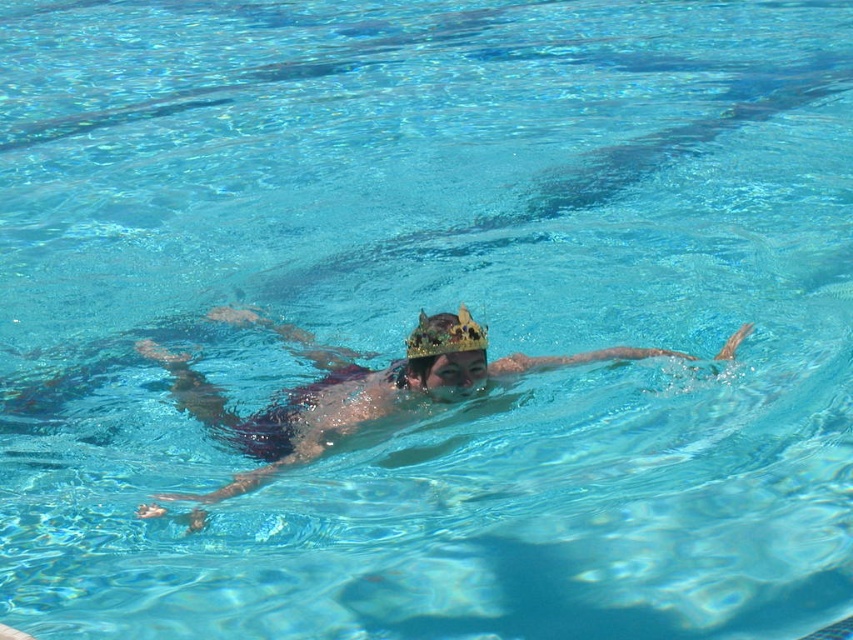
You are designing a poster for a pool party and want to highlight the swimmer with the crown. Which crown is larger in size between the metallic gold crown at center and the gold glittery crown at center?

The metallic gold crown at center is bigger than the gold glittery crown at center, so the metallic gold crown at center should be emphasized in the poster design.

You are a photographer trying to capture the swimmer with both the metallic gold crown at center and the gold glittery crown at center. Which crown will appear closer to the camera in the photo?

The metallic gold crown at center will appear closer to the camera because it is positioned in front of the gold glittery crown at center.